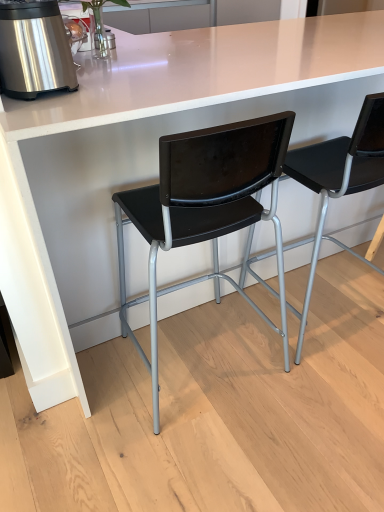
I want to click on vacant area to the right of stainless steel appliance at left, so click(x=110, y=85).